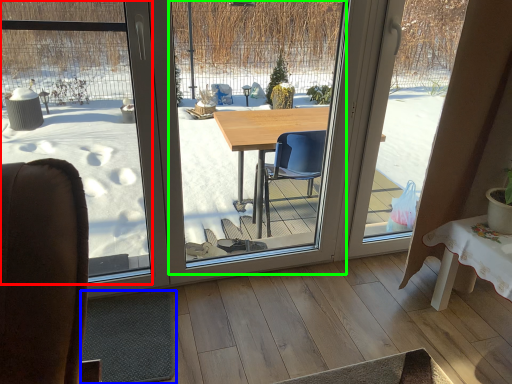
Question: Based on their relative distances, which object is nearer to window screen (highlighted by a red box)? Choose from flat (highlighted by a blue box) and window screen (highlighted by a green box).

Choices:
 (A) flat
 (B) window screen

Answer: (A)